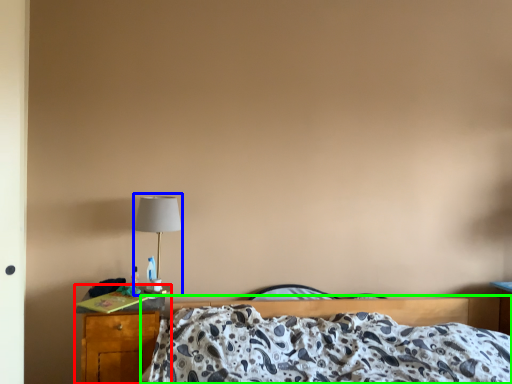
Question: Estimate the real-world distances between objects in this image. Which object is closer to nightstand (highlighted by a red box), table lamp (highlighted by a blue box) or bed (highlighted by a green box)?

Choices:
 (A) table lamp
 (B) bed

Answer: (A)